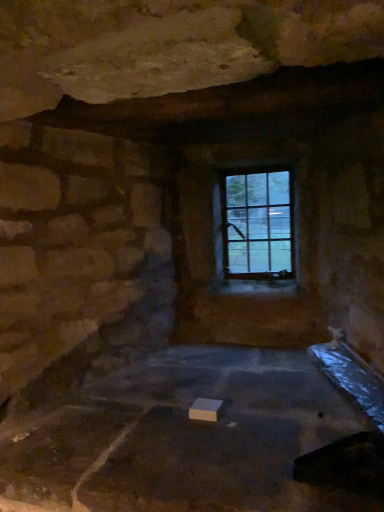
This screenshot has height=512, width=384. I want to click on vacant area on top of white matte block at center (from a real-world perspective), so click(218, 410).